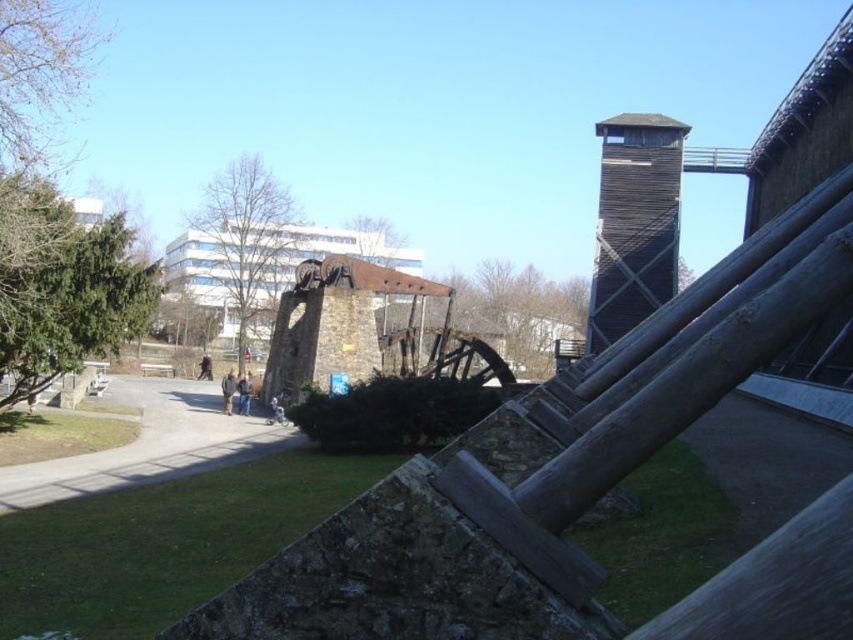
Question: Is green grass at lower left wider than green grass at lower right?

Choices:
 (A) yes
 (B) no

Answer: (A)

Question: Which point is farther from the camera taking this photo?

Choices:
 (A) (138, 381)
 (B) (576, 531)

Answer: (A)

Question: Does green grass at lower left come in front of wooden tower at upper right?

Choices:
 (A) no
 (B) yes

Answer: (B)

Question: Is the position of green grass at lower left more distant than that of wooden tower at upper right?

Choices:
 (A) no
 (B) yes

Answer: (A)

Question: Which point is closer to the camera?

Choices:
 (A) (595, 557)
 (B) (622, 252)
 (C) (53, 592)

Answer: (A)

Question: Which of the following is the closest to the observer?

Choices:
 (A) gray concrete path at center
 (B) green grass at lower right

Answer: (B)